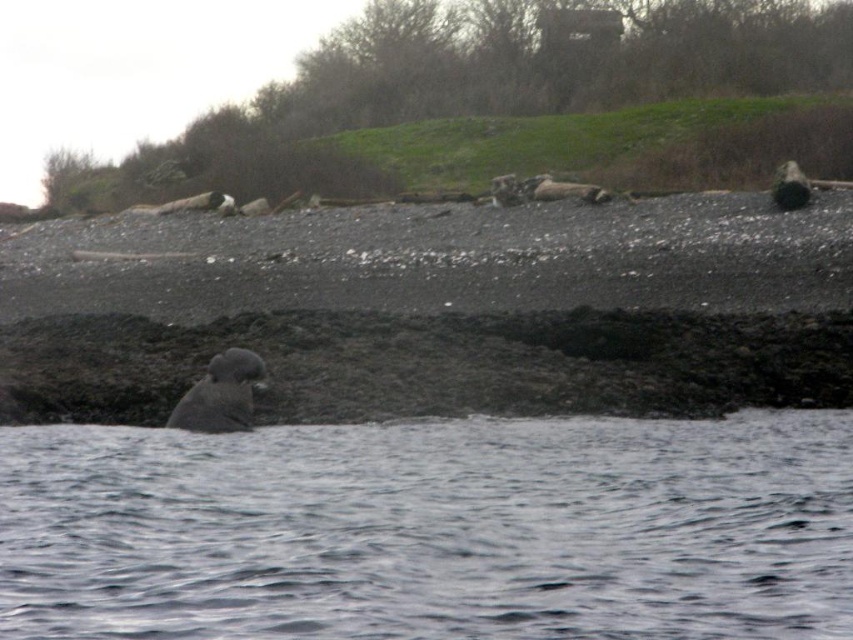
You are standing on the shoreline and see the clear water at lower center and the gray fur seal at center. Which object is taller when viewed from your perspective?

The gray fur seal at center is taller than the clear water at lower center.

You are standing on the shoreline looking out at the water. There is a point marked at coordinates (432,529). What is located at this point?

→ The point at coordinates (432,529) corresponds to clear water at lower center.

You are standing at the shoreline looking towards the grassy area. There are two points marked in the image, point A at coordinates point (177, 513) and point B at coordinates point (219, 413). Which point is closer to you?

Point (177, 513) is closer to the viewer than point (219, 413).